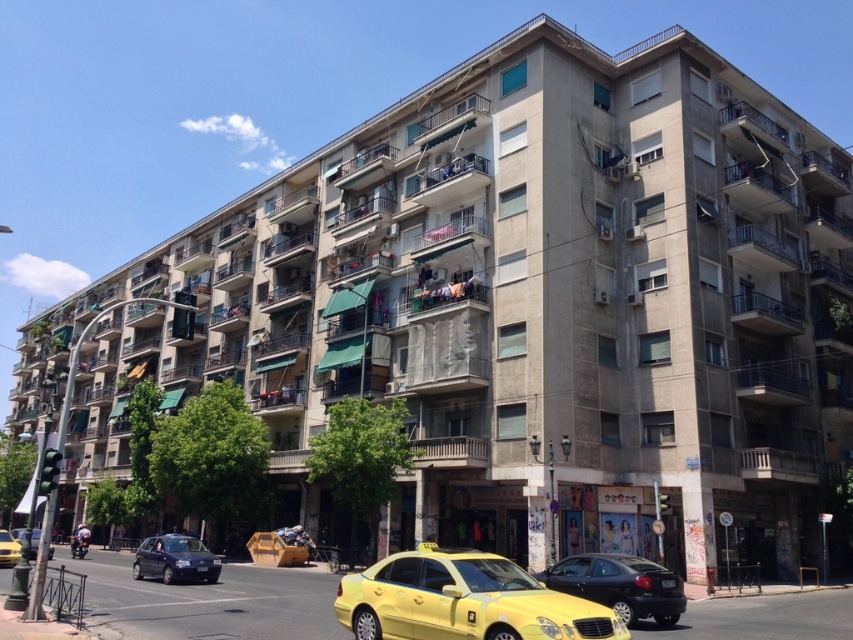
Can you confirm if black glossy sedan at center is positioned to the right of yellow matte taxi at lower left?

Indeed, black glossy sedan at center is positioned on the right side of yellow matte taxi at lower left.

Looking at this image, is black glossy sedan at center to the left of yellow matte taxi at lower left from the viewer's perspective?

Incorrect, black glossy sedan at center is not on the left side of yellow matte taxi at lower left.

Who is more distant from viewer, (622, 616) or (3, 536)?

Point (3, 536)

At what (x,y) coordinates should I click in order to perform the action: click on black glossy sedan at center. Please return your answer as a coordinate pair (x, y). Looking at the image, I should click on (619, 586).

Is yellow matte taxi at lower left to the left of black plastic license plate at lower center from the viewer's perspective?

Yes, yellow matte taxi at lower left is to the left of black plastic license plate at lower center.

Between yellow matte taxi at lower left and black plastic license plate at lower center, which one has less height?

black plastic license plate at lower center

Between point (10, 556) and point (664, 580), which one is positioned behind?

The point (10, 556) is behind.

Locate an element on the screen. yellow matte taxi at lower left is located at coordinates (9, 548).

Locate an element on the screen. The height and width of the screenshot is (640, 853). yellow matte taxi at lower center is located at coordinates (463, 600).

Does point (502, 580) lie in front of point (645, 566)?

Yes, point (502, 580) is closer to viewer.

This screenshot has width=853, height=640. What do you see at coordinates (463, 600) in the screenshot?
I see `yellow matte taxi at lower center` at bounding box center [463, 600].

This screenshot has width=853, height=640. What are the coordinates of `yellow matte taxi at lower center` in the screenshot? It's located at (463, 600).